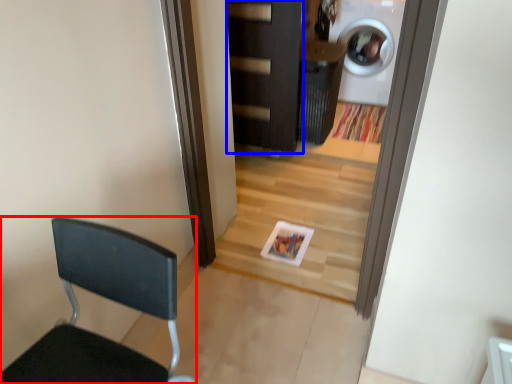
Question: Which of the following is the closest to the observer, chair (highlighted by a red box) or door (highlighted by a blue box)?

Choices:
 (A) chair
 (B) door

Answer: (A)